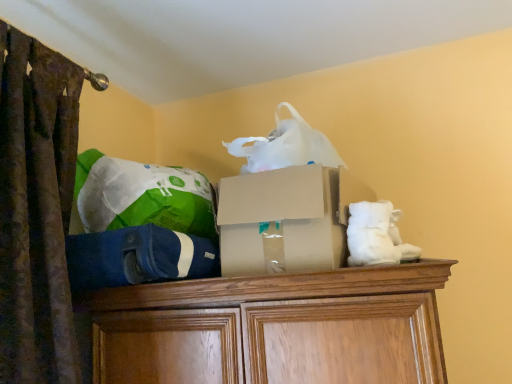
Question: Is green fabric bean bag chair at upper left, positioned as the second bean bag chair in bottom-to-top order, taller or shorter than blue fabric bean bag chair at center, acting as the second bean bag chair starting from the top?

Choices:
 (A) short
 (B) tall

Answer: (B)

Question: Is green fabric bean bag chair at upper left, positioned as the second bean bag chair in bottom-to-top order, wider or thinner than blue fabric bean bag chair at center, which is the first bean bag chair in bottom-to-top order?

Choices:
 (A) thin
 (B) wide

Answer: (A)

Question: Based on their relative distances, which object is farther from the green fabric bean bag chair at upper left, which is the first bean bag chair in top-to-bottom order?

Choices:
 (A) blue fabric bean bag chair at center, which is the first bean bag chair in bottom-to-top order
 (B) cardboard box at center

Answer: (B)

Question: Estimate the real-world distances between objects in this image. Which object is closer to the blue fabric bean bag chair at center, which is the first bean bag chair in bottom-to-top order?

Choices:
 (A) cardboard box at center
 (B) green fabric bean bag chair at upper left, which is the first bean bag chair in top-to-bottom order

Answer: (B)